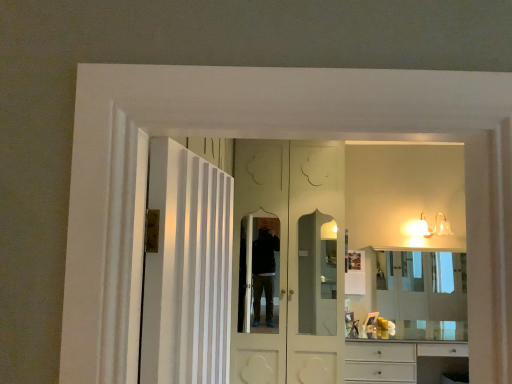
Question: From the image's perspective, is white glossy cabinet at lower right under clear glass mirror at center?

Choices:
 (A) no
 (B) yes

Answer: (B)

Question: Considering the relative sizes of white glossy cabinet at lower right and clear glass mirror at center in the image provided, is white glossy cabinet at lower right wider than clear glass mirror at center?

Choices:
 (A) no
 (B) yes

Answer: (B)

Question: Is white glossy cabinet at lower right surrounding clear glass mirror at center?

Choices:
 (A) yes
 (B) no

Answer: (B)

Question: Considering the relative sizes of white glossy cabinet at lower right and clear glass mirror at center in the image provided, is white glossy cabinet at lower right taller than clear glass mirror at center?

Choices:
 (A) yes
 (B) no

Answer: (B)

Question: From the image's perspective, is white glossy cabinet at lower right on top of clear glass mirror at center?

Choices:
 (A) yes
 (B) no

Answer: (B)

Question: Considering their positions, is white glossy door at center, arranged as the second door when viewed from the back, located in front of or behind white glossy cabinet at lower right?

Choices:
 (A) front
 (B) behind

Answer: (A)

Question: In terms of height, does white glossy door at center, marked as the first door in a front-to-back arrangement, look taller or shorter compared to white glossy cabinet at lower right?

Choices:
 (A) tall
 (B) short

Answer: (A)

Question: Visually, is white glossy door at center, arranged as the second door when viewed from the back, positioned to the left or to the right of white glossy cabinet at lower right?

Choices:
 (A) right
 (B) left

Answer: (B)

Question: From the image's perspective, relative to white glossy cabinet at lower right, is white glossy door at center, arranged as the second door when viewed from the back, above or below?

Choices:
 (A) above
 (B) below

Answer: (A)

Question: From the image's perspective, is white glossy door at center, arranged as the second door when viewed from the back, located above or below clear glass mirror at center?

Choices:
 (A) below
 (B) above

Answer: (B)

Question: Is white glossy door at center, arranged as the second door when viewed from the back, wider or thinner than clear glass mirror at center?

Choices:
 (A) thin
 (B) wide

Answer: (B)

Question: Is white glossy door at center, marked as the first door in a front-to-back arrangement, inside or outside of clear glass mirror at center?

Choices:
 (A) outside
 (B) inside

Answer: (A)

Question: From a real-world perspective, is white glossy door at center, arranged as the second door when viewed from the back, above or below clear glass mirror at center?

Choices:
 (A) above
 (B) below

Answer: (A)

Question: From a real-world perspective, is white glossy door at center, arranged as the second door when viewed from the back, positioned above or below white glossy wall sconce at upper right?

Choices:
 (A) above
 (B) below

Answer: (B)

Question: In the image, is white glossy door at center, marked as the first door in a front-to-back arrangement, on the left side or the right side of white glossy wall sconce at upper right?

Choices:
 (A) right
 (B) left

Answer: (B)